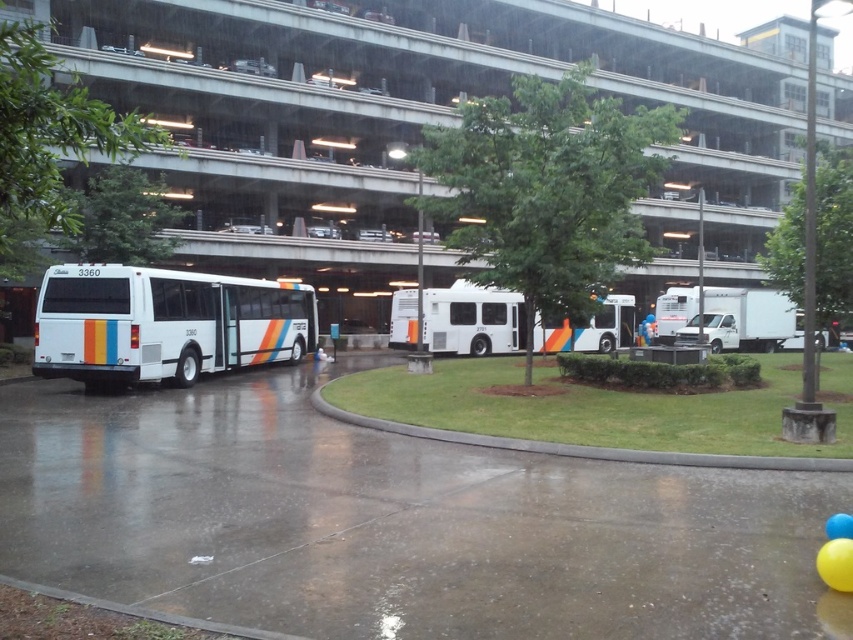
You are a delivery person needing to cross from the green grass at lower center to the white matte bus at center. Given that your delivery cart can only handle slopes less than 10 degrees, can you safely make this journey?

The white matte bus at center and green grass at lower center are 15.00 meters apart from each other. However, the question of slope safety depends on the vertical distance between them, which isn not provided in the objects description. Without knowing the elevation change, it is impossible to determine if the slope is less than 10 degrees.

You are standing on the green grass at lower center and want to walk towards the white concrete parking garage at upper center. Is the parking garage closer to you or farther away?

The white concrete parking garage at upper center is further to the viewer than the green grass at lower center, so the parking garage is farther away from you.

You are standing at the entrance of the parking structure and want to locate the white matte bus at center. According to the coordinates provided, where should you look relative to the parking structure?

The white matte bus at center is located at point coordinates [473,320], which places it near the center of the parking structure.